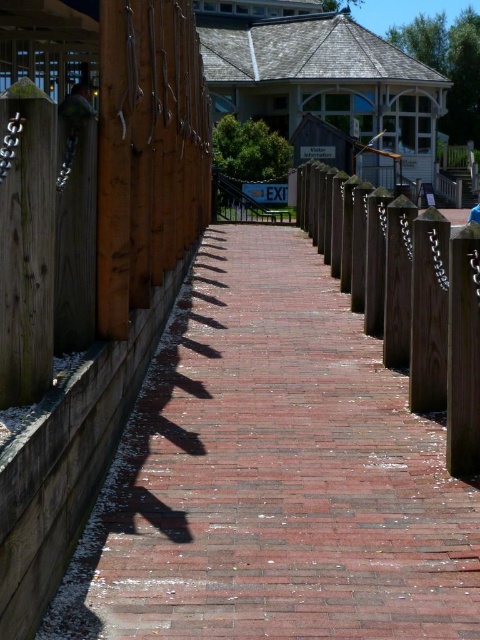
Question: Observing the image, what is the correct spatial positioning of red brick path at center in reference to wooden post at center?

Choices:
 (A) above
 (B) below

Answer: (B)

Question: Which point appears closest to the camera in this image?

Choices:
 (A) (403, 220)
 (B) (287, 609)

Answer: (B)

Question: Which of the following is the closest to the observer?

Choices:
 (A) wooden post at center
 (B) red brick path at center

Answer: (B)

Question: In this image, where is red brick path at center located relative to wooden post at center?

Choices:
 (A) above
 (B) below

Answer: (B)

Question: Is red brick path at center closer to the viewer compared to wooden post at center?

Choices:
 (A) no
 (B) yes

Answer: (B)